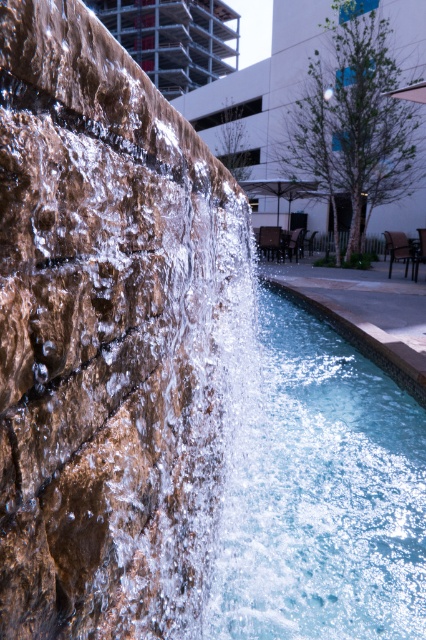
Which is in front, point (43, 65) or point (281, 628)?

Point (43, 65)

Who is more distant from viewer, (x=178, y=243) or (x=299, y=392)?

Point (x=299, y=392)

Image resolution: width=426 pixels, height=640 pixels. I want to click on brown stone waterfall at left, so click(x=108, y=336).

Is clear glass swimming pool at center taller than smooth concrete wall at center?

In fact, clear glass swimming pool at center may be shorter than smooth concrete wall at center.

Who is positioned more to the left, clear glass swimming pool at center or smooth concrete wall at center?

smooth concrete wall at center

Is point (305, 595) closer to viewer compared to point (379, 92)?

That is True.

This screenshot has height=640, width=426. What are the coordinates of `clear glass swimming pool at center` in the screenshot? It's located at (316, 490).

Between clear glass swimming pool at center and metallic silver building at upper center, which one appears on the left side from the viewer's perspective?

metallic silver building at upper center

Looking at this image, measure the distance from clear glass swimming pool at center to metallic silver building at upper center.

54.95 meters

Between point (386, 451) and point (120, 6), which one is positioned in front?

Point (386, 451)

I want to click on clear glass swimming pool at center, so click(316, 490).